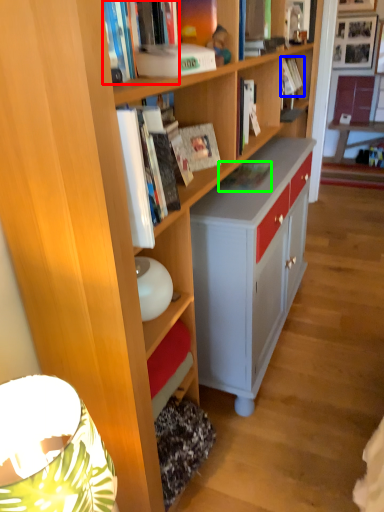
Question: Which object is positioned closest to book (highlighted by a red box)? Select from book (highlighted by a blue box) and book (highlighted by a green box).

Choices:
 (A) book
 (B) book

Answer: (B)